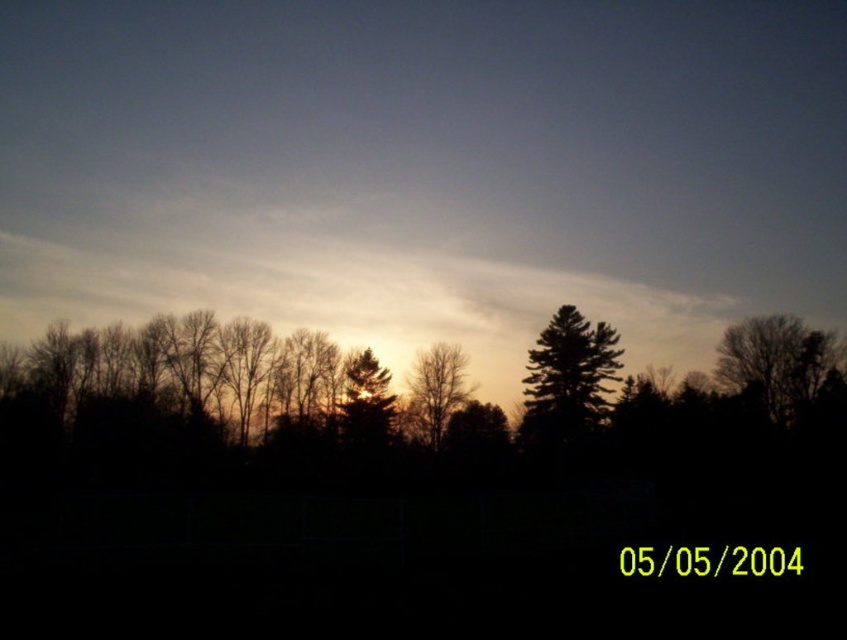
You are an artist trying to paint the sunset scene. You notice the dark green textured tree at center and the bare branches at right. Which object should you paint first if you want to follow the standard layering technique where closer objects are painted over distant ones?

You should paint the bare branches at right first because the dark green textured tree at center is below it, meaning the tree is closer and should be painted over the branches to maintain depth perception.

You are a landscape architect planning to install a 20 meter long pathway between the bare branches at right and the brown matte tree at center. Based on the scene description, will the pathway fit between them?

The distance between the bare branches at right and the brown matte tree at center is 21.67 meters, which is longer than the 20 meter pathway, so the pathway will fit between them.

You are an artist trying to paint this sunset scene. You want to ensure the bare branches at right and brown matte tree at center are proportionally accurate. Which object should you paint larger?

The bare branches at right should be painted larger since it is bigger than the brown matte tree at center according to the description.